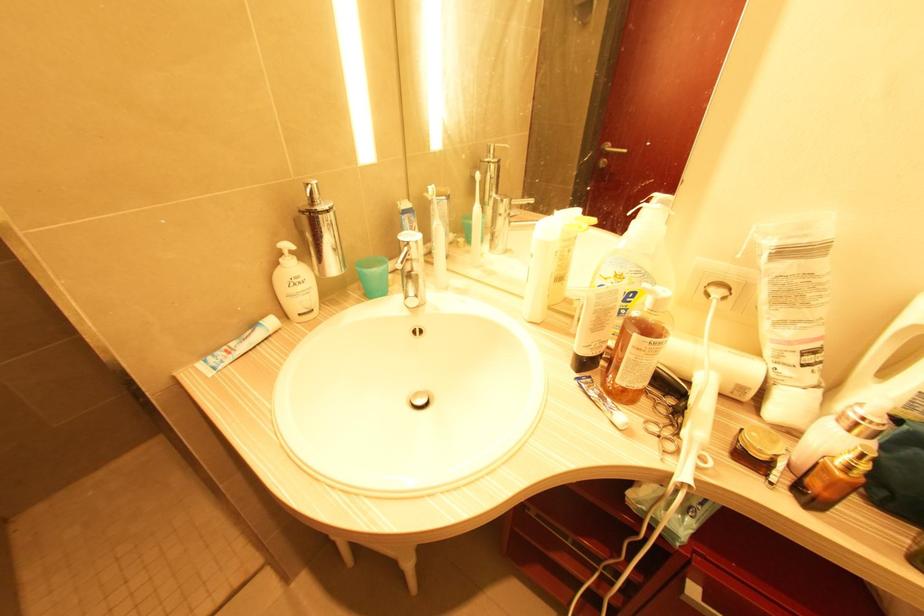
Image resolution: width=924 pixels, height=616 pixels. Identify the location of silver dispenser pump. (321, 233).